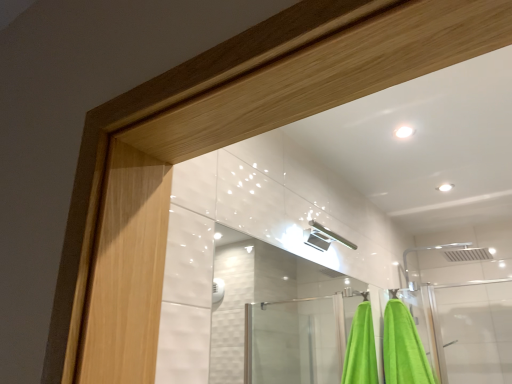
Measure the distance between green fabric towel at lower right and camera.

They are 1.97 meters apart.

The image size is (512, 384). What do you see at coordinates (403, 348) in the screenshot?
I see `green fabric towel at lower right` at bounding box center [403, 348].

This screenshot has width=512, height=384. Identify the location of green fabric towel at lower right. click(x=403, y=348).

What is the approximate width of green fabric towel at lower right?

green fabric towel at lower right is 11.17 inches wide.

The height and width of the screenshot is (384, 512). I want to click on green fabric towel at lower right, so click(x=403, y=348).